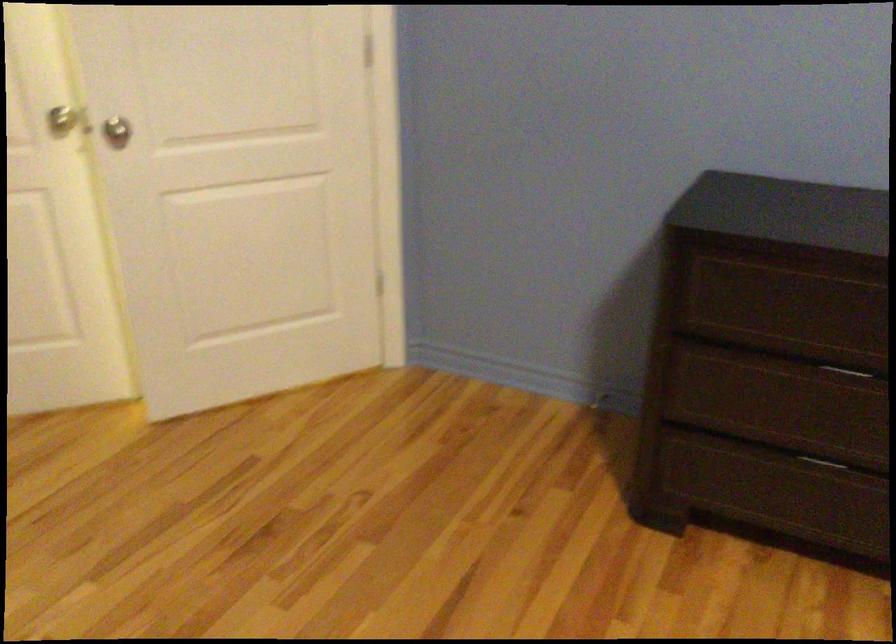
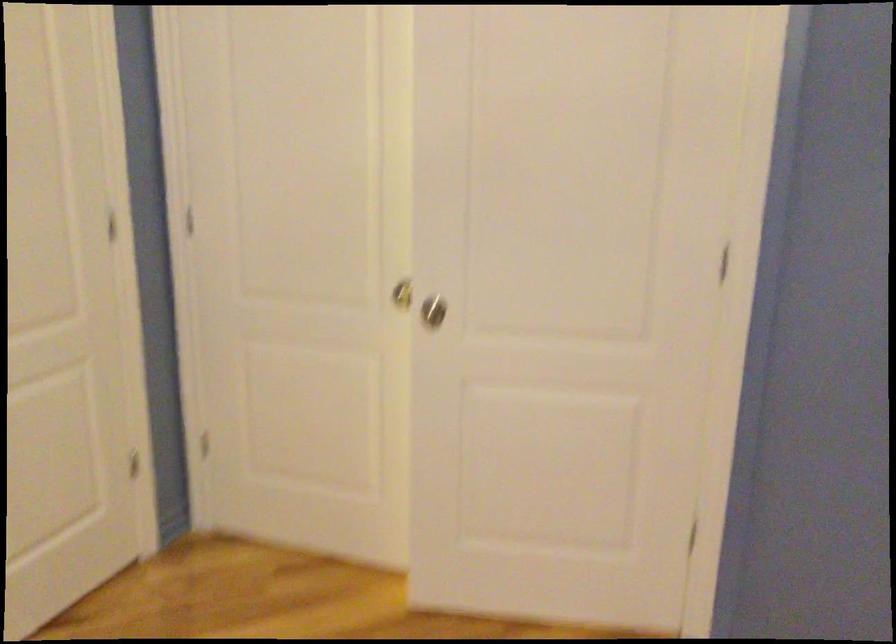
Find the pixel in the second image that matches point (108, 126) in the first image.

(433, 310)